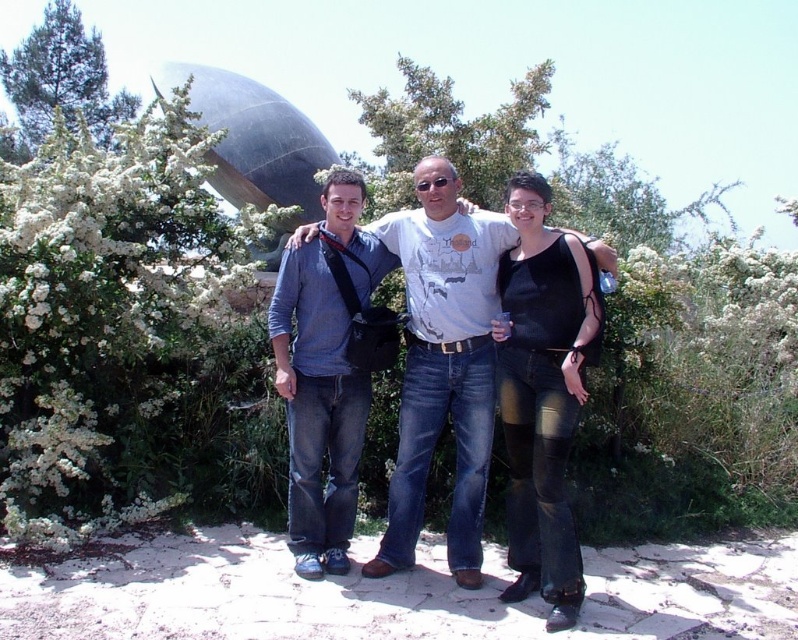
Question: In this image, where is white fluffy bush at left located relative to denim jeans at center?

Choices:
 (A) right
 (B) left

Answer: (B)

Question: Which of the following is the closest to the observer?

Choices:
 (A) (352, 424)
 (B) (563, 428)
 (C) (407, 564)
 (D) (76, 483)

Answer: (B)

Question: Which object is the closest to the white fluffy bush at left?

Choices:
 (A) denim jeans at center
 (B) matte gray t-shirt at center
 (C) black mesh top at center

Answer: (A)

Question: Can you confirm if white fluffy bush at left is positioned below black mesh top at center?

Choices:
 (A) yes
 (B) no

Answer: (B)

Question: Is black mesh top at center smaller than denim jeans at center?

Choices:
 (A) yes
 (B) no

Answer: (A)

Question: Which point is closer to the camera?

Choices:
 (A) matte gray t-shirt at center
 (B) white fluffy bush at left

Answer: (A)